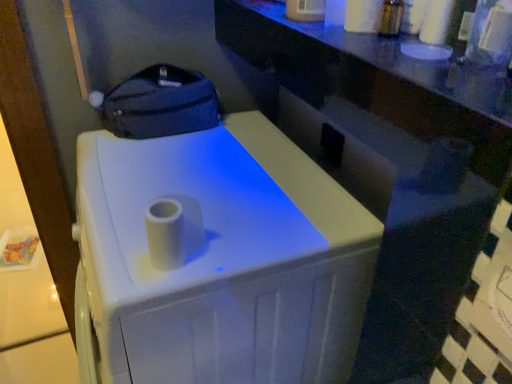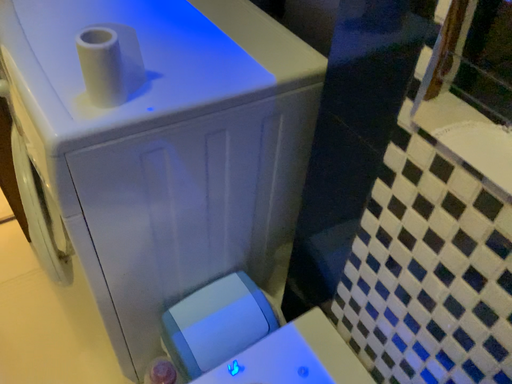
Question: Which way did the camera rotate in the video?

Choices:
 (A) rotated downward
 (B) rotated upward

Answer: (A)